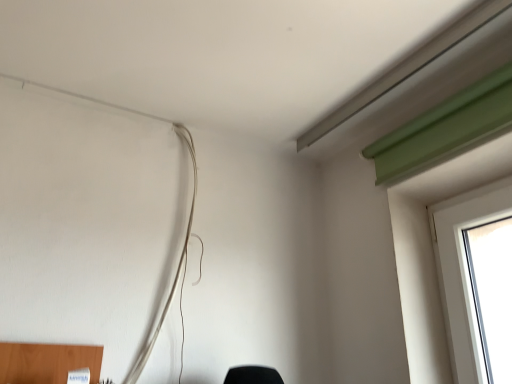
Question: Can you confirm if black matte lampshade at lower center is bigger than white matte wire at upper left?

Choices:
 (A) no
 (B) yes

Answer: (A)

Question: From the image's perspective, is black matte lampshade at lower center under white matte wire at upper left?

Choices:
 (A) no
 (B) yes

Answer: (B)

Question: From a real-world perspective, is black matte lampshade at lower center located higher than white matte wire at upper left?

Choices:
 (A) no
 (B) yes

Answer: (A)

Question: Is black matte lampshade at lower center shorter than white matte wire at upper left?

Choices:
 (A) yes
 (B) no

Answer: (A)

Question: From the image's perspective, is black matte lampshade at lower center on top of white matte wire at upper left?

Choices:
 (A) no
 (B) yes

Answer: (A)

Question: Can you confirm if black matte lampshade at lower center is positioned to the right of white matte wire at upper left?

Choices:
 (A) yes
 (B) no

Answer: (A)

Question: Does white matte wire at upper left have a lesser width compared to black matte lampshade at lower center?

Choices:
 (A) yes
 (B) no

Answer: (A)

Question: Could you tell me if white matte wire at upper left is turned towards black matte lampshade at lower center?

Choices:
 (A) yes
 (B) no

Answer: (B)

Question: From the image's perspective, is white matte wire at upper left under black matte lampshade at lower center?

Choices:
 (A) yes
 (B) no

Answer: (B)

Question: From a real-world perspective, is white matte wire at upper left on black matte lampshade at lower center?

Choices:
 (A) yes
 (B) no

Answer: (A)

Question: From a real-world perspective, is white matte wire at upper left located beneath black matte lampshade at lower center?

Choices:
 (A) yes
 (B) no

Answer: (B)

Question: Is white matte wire at upper left in contact with black matte lampshade at lower center?

Choices:
 (A) no
 (B) yes

Answer: (A)

Question: Based on their sizes in the image, would you say white matte wire at upper left is bigger or smaller than black matte lampshade at lower center?

Choices:
 (A) big
 (B) small

Answer: (A)